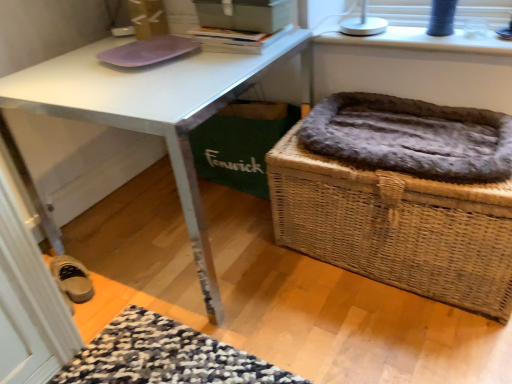
Locate an element on the screen. Image resolution: width=512 pixels, height=384 pixels. vacant space underneath white glossy desk at center (from a real-world perspective) is located at coordinates (170, 230).